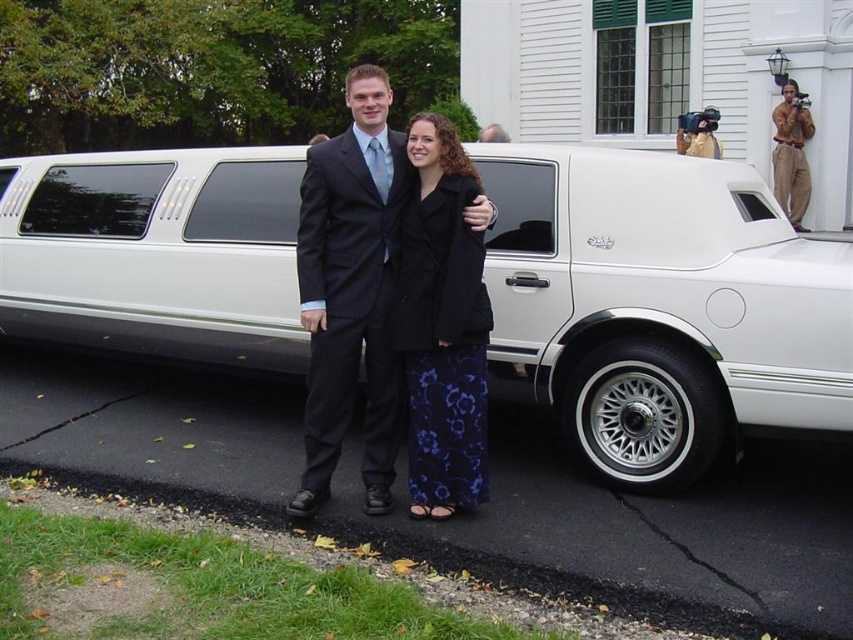
You are a photographer trying to capture a clear shot of both the white metallic limousine at center and the matte black suit at center. Since the limousine is closer to you, will it appear larger in the photo than the suit?

Yes, the white metallic limousine at center is closer to the viewer than the matte black suit at center, so it will appear larger in the photo.